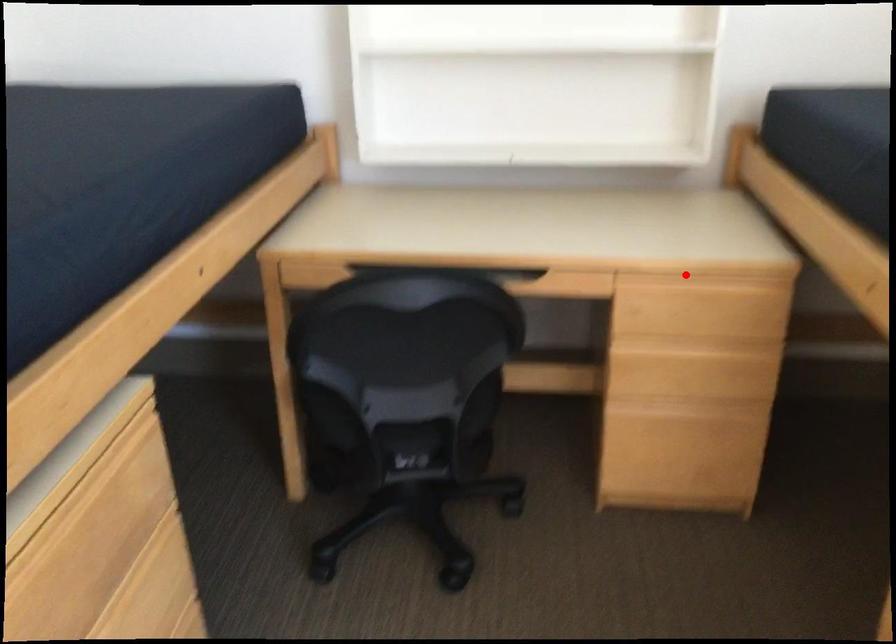
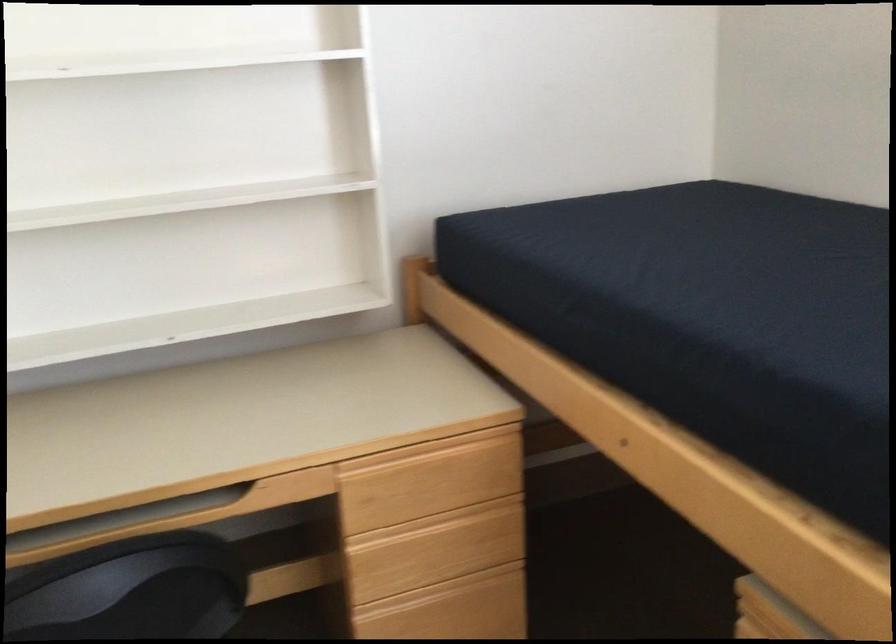
Find the pixel in the second image that matches the highlighted location in the first image.

(417, 451)